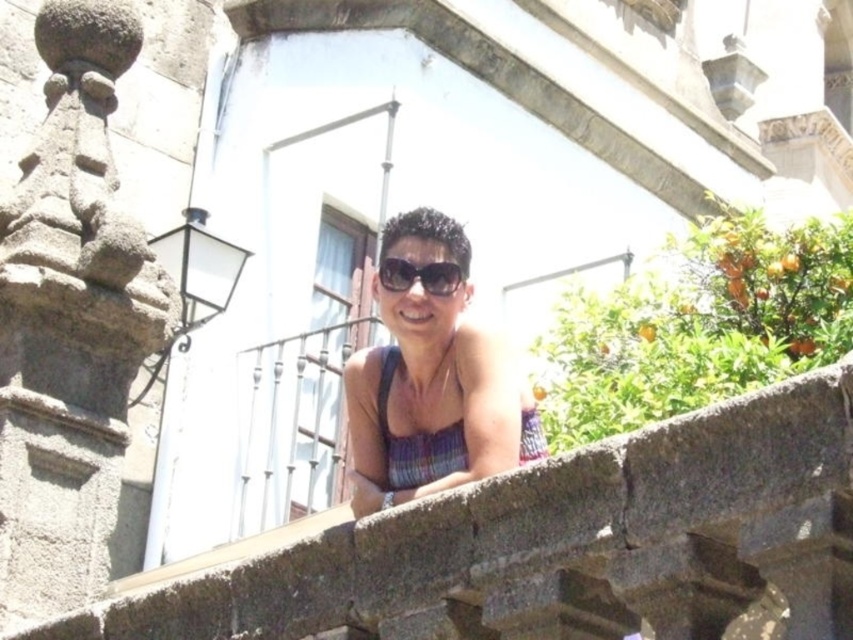
You are a fashion designer observing a model wearing the multicolored knit bikini top at center and black plastic sunglasses at center. Which item is taller when viewed from the front?

The multicolored knit bikini top at center has a greater height compared to the black plastic sunglasses at center, so the bikini top is taller.

You are standing at the point marked as point (697, 324). Looking around, you see a green leafy bush at upper right. Can you tell me which direction the green leafy bush at upper right is from your current position?

The green leafy bush at upper right is located at point (697, 324), which is your current position. Therefore, you are already at the location of the green leafy bush at upper right.

You are a photographer trying to capture the multicolored knit bikini top at center in your shot. The camera is positioned at point 0.5,0.5. Can you determine if the bikini top is in the center of the image?

The multicolored knit bikini top at center is located at point (x=415, y=440), which is slightly to the right and above the center point (x=426, y=320). Therefore, it is not exactly centered in the image.